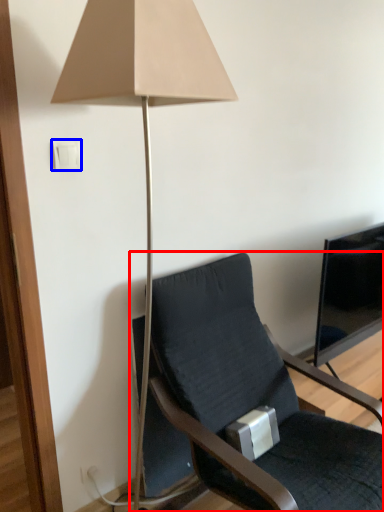
Question: Which object is closer to the camera taking this photo, chair (highlighted by a red box) or light switch (highlighted by a blue box)?

Choices:
 (A) chair
 (B) light switch

Answer: (A)